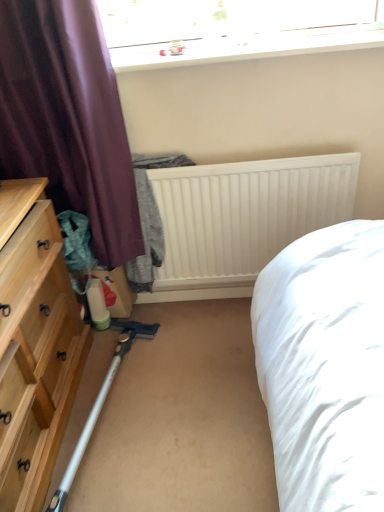
Question: Could you tell me if white matte radiator at center is facing transparent glass window at upper center?

Choices:
 (A) no
 (B) yes

Answer: (A)

Question: Can you confirm if white matte radiator at center is taller than transparent glass window at upper center?

Choices:
 (A) yes
 (B) no

Answer: (A)

Question: Considering the relative sizes of white matte radiator at center and transparent glass window at upper center in the image provided, is white matte radiator at center smaller than transparent glass window at upper center?

Choices:
 (A) yes
 (B) no

Answer: (B)

Question: Is white matte radiator at center placed right next to transparent glass window at upper center?

Choices:
 (A) no
 (B) yes

Answer: (A)

Question: From the image's perspective, is white matte radiator at center below transparent glass window at upper center?

Choices:
 (A) yes
 (B) no

Answer: (A)

Question: Considering their positions, is white matte radiator at center located in front of or behind purple fabric curtain at left?

Choices:
 (A) behind
 (B) front

Answer: (A)

Question: Is white matte radiator at center wider or thinner than purple fabric curtain at left?

Choices:
 (A) thin
 (B) wide

Answer: (A)

Question: From a real-world perspective, is white matte radiator at center above or below purple fabric curtain at left?

Choices:
 (A) above
 (B) below

Answer: (B)

Question: Is white matte radiator at center bigger or smaller than purple fabric curtain at left?

Choices:
 (A) small
 (B) big

Answer: (A)

Question: Would you say transparent glass window at upper center is to the left or to the right of white plastic vacuum cleaner at lower left in the picture?

Choices:
 (A) left
 (B) right

Answer: (B)

Question: Considering the positions of transparent glass window at upper center and white plastic vacuum cleaner at lower left in the image, is transparent glass window at upper center taller or shorter than white plastic vacuum cleaner at lower left?

Choices:
 (A) tall
 (B) short

Answer: (B)

Question: Considering the positions of transparent glass window at upper center and white plastic vacuum cleaner at lower left in the image, is transparent glass window at upper center bigger or smaller than white plastic vacuum cleaner at lower left?

Choices:
 (A) small
 (B) big

Answer: (A)

Question: Would you say transparent glass window at upper center is inside or outside white plastic vacuum cleaner at lower left?

Choices:
 (A) inside
 (B) outside

Answer: (B)

Question: Looking at the image, does natural wood dresser at left seem bigger or smaller compared to white plastic vacuum cleaner at lower left?

Choices:
 (A) big
 (B) small

Answer: (A)

Question: From a real-world perspective, is natural wood dresser at left positioned above or below white plastic vacuum cleaner at lower left?

Choices:
 (A) above
 (B) below

Answer: (A)